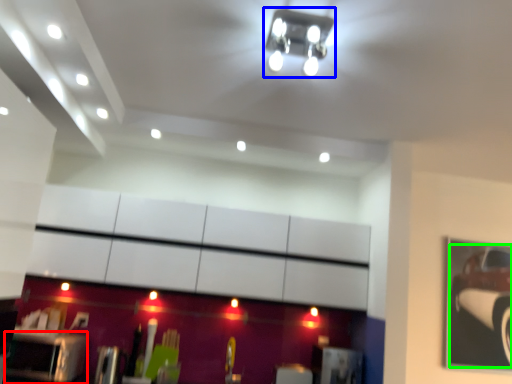
Question: Which is nearer to the furniture (highlighted by a red box)? light fixture (highlighted by a blue box) or car (highlighted by a green box).

Choices:
 (A) light fixture
 (B) car

Answer: (A)